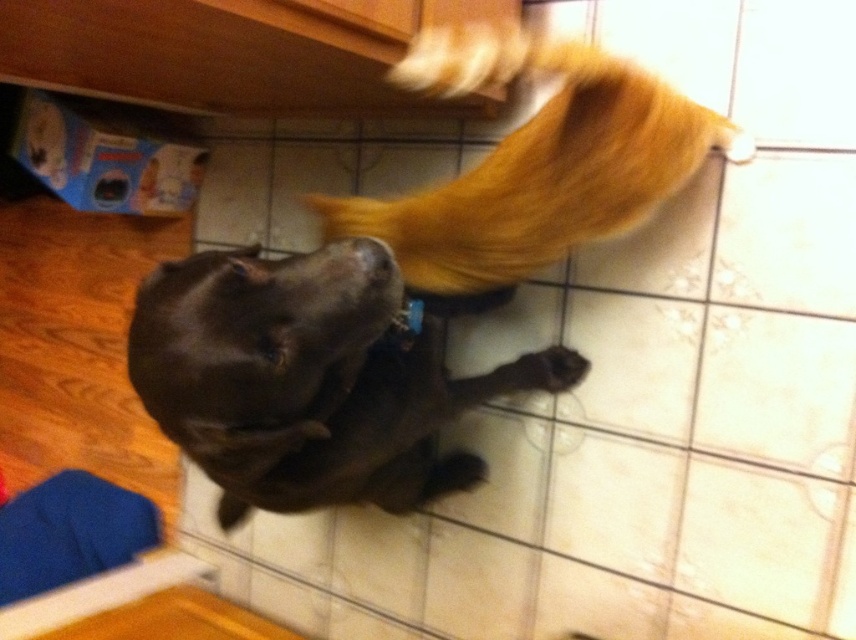
You are holding a camera and want to take a photo of the shiny brown dog at center. The camera requires a minimum distance of 36 inches to focus properly. Can you take a clear photo from your current position?

The shiny brown dog at center and camera are 30.68 inches apart from each other. Since the required minimum distance is 36 inches, you need to move back to increase the distance between the camera and the shiny brown dog at center to ensure proper focus.

You are standing in the kitchen and want to move from the point at coordinates point (672, 339) to the point at coordinates point (559, 387). Is the destination point closer to you or further away?

Point (672, 339) is in front of point (559, 387), so the destination point at (559, 387) is further away from you.

You are a dog trainer observing the scene. You need to place a treat between the shiny brown dog at center and the brown fur paw at lower center. Is there enough space to fit a treat that is 12 inches long?

The distance between the shiny brown dog at center and the brown fur paw at lower center is 15.58 inches, so yes, the treat can be placed between them as the space is larger than the treat length.